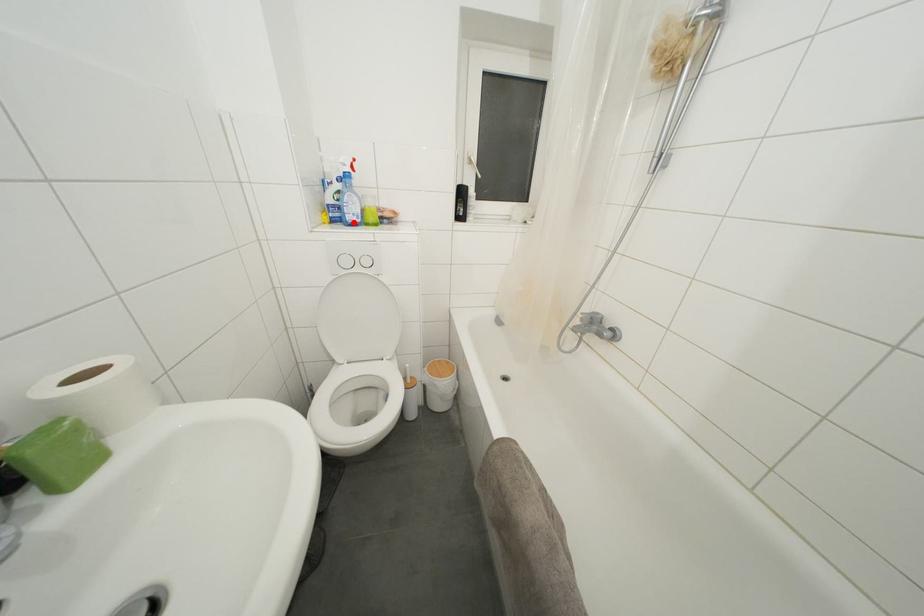
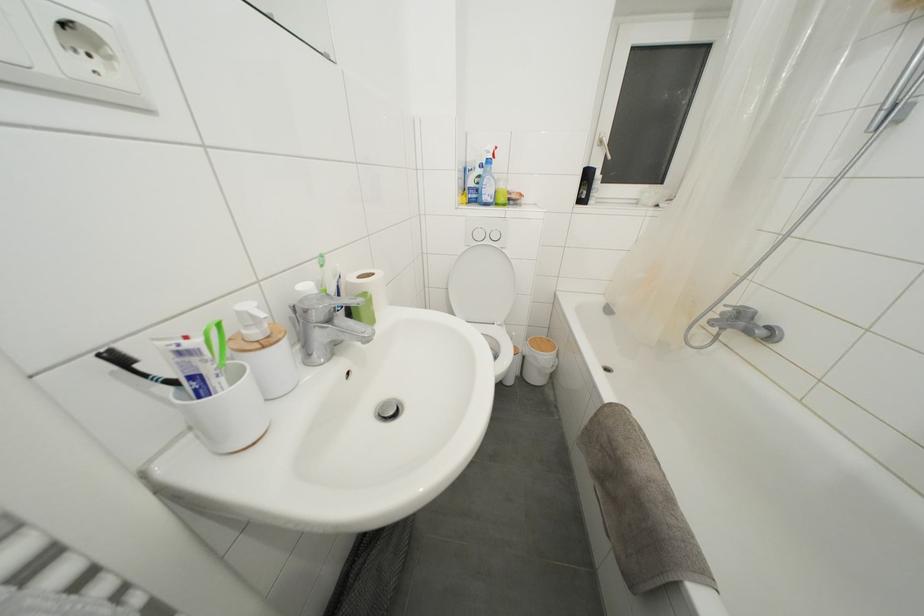
Question: I am providing you with two images of the same scene from different viewpoints. A red point is shown in image1. For the corresponding object point in image2, is it positioned nearer or farther from the camera?

Choices:
 (A) Nearer
 (B) Farther

Answer: (A)